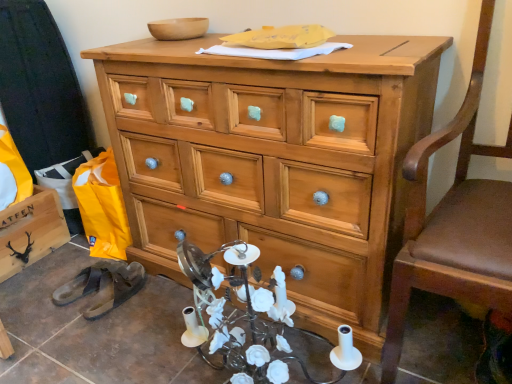
Question: From a real-world perspective, is black matte wooden cabinet at lower left positioned over brown leather swivel chair at right based on gravity?

Choices:
 (A) no
 (B) yes

Answer: (A)

Question: Is brown leather swivel chair at right a part of black matte wooden cabinet at lower left?

Choices:
 (A) yes
 (B) no

Answer: (B)

Question: Considering the relative sizes of black matte wooden cabinet at lower left and brown leather swivel chair at right in the image provided, is black matte wooden cabinet at lower left bigger than brown leather swivel chair at right?

Choices:
 (A) yes
 (B) no

Answer: (B)

Question: Considering the relative positions of black matte wooden cabinet at lower left and brown leather swivel chair at right in the image provided, is black matte wooden cabinet at lower left to the right of brown leather swivel chair at right from the viewer's perspective?

Choices:
 (A) no
 (B) yes

Answer: (A)

Question: Does black matte wooden cabinet at lower left have a greater width compared to brown leather swivel chair at right?

Choices:
 (A) yes
 (B) no

Answer: (B)

Question: Considering the relative positions of black matte wooden cabinet at lower left and brown leather swivel chair at right in the image provided, is black matte wooden cabinet at lower left in front of brown leather swivel chair at right?

Choices:
 (A) no
 (B) yes

Answer: (A)

Question: Is brown leather swivel chair at right not within black rubber sandals at lower left?

Choices:
 (A) no
 (B) yes

Answer: (B)

Question: Considering the relative sizes of brown leather swivel chair at right and black rubber sandals at lower left in the image provided, is brown leather swivel chair at right wider than black rubber sandals at lower left?

Choices:
 (A) no
 (B) yes

Answer: (B)

Question: Considering the relative sizes of brown leather swivel chair at right and black rubber sandals at lower left in the image provided, is brown leather swivel chair at right taller than black rubber sandals at lower left?

Choices:
 (A) no
 (B) yes

Answer: (B)

Question: Would you say brown leather swivel chair at right contains black rubber sandals at lower left?

Choices:
 (A) yes
 (B) no

Answer: (B)

Question: Considering the relative positions of brown leather swivel chair at right and black rubber sandals at lower left in the image provided, is brown leather swivel chair at right in front of black rubber sandals at lower left?

Choices:
 (A) yes
 (B) no

Answer: (A)

Question: Does brown leather swivel chair at right appear on the right side of black rubber sandals at lower left?

Choices:
 (A) no
 (B) yes

Answer: (B)

Question: From a real-world perspective, is natural wood chest of drawers at center located beneath brown leather swivel chair at right?

Choices:
 (A) no
 (B) yes

Answer: (B)